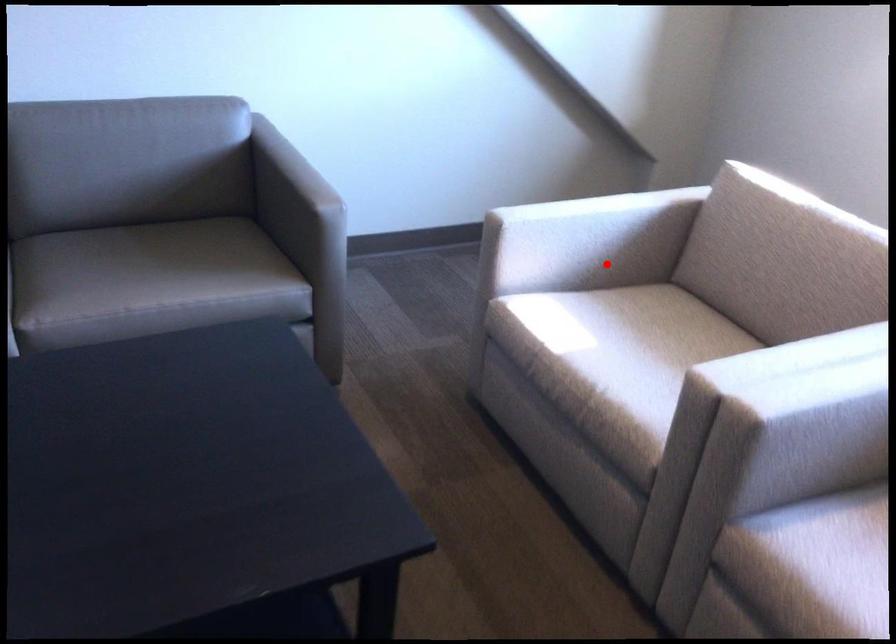
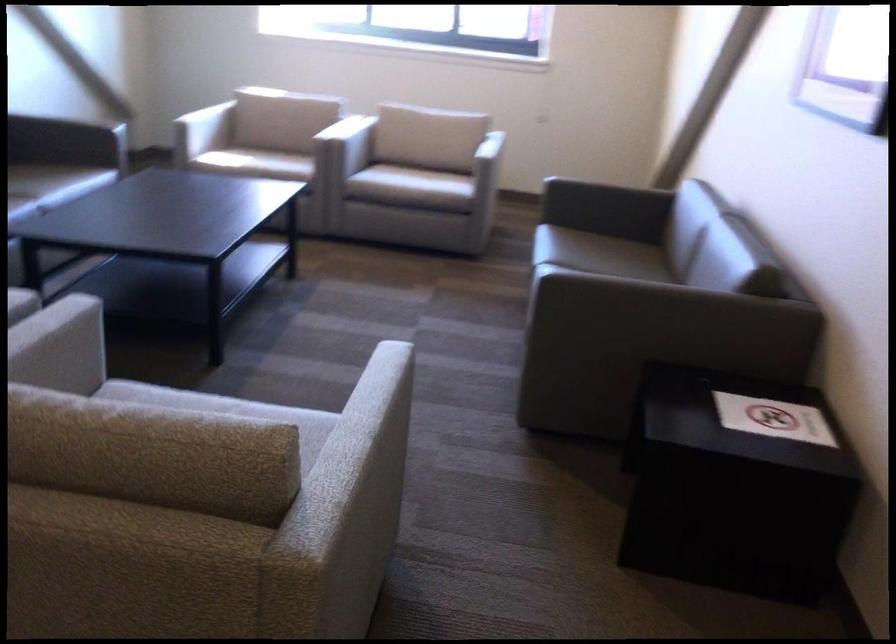
Question: I am providing you with two images of the same scene from different viewpoints. Given a red point in image1, look at the same physical point in image2. Is it:

Choices:
 (A) Closer to the viewpoint
 (B) Farther from the viewpoint

Answer: (B)